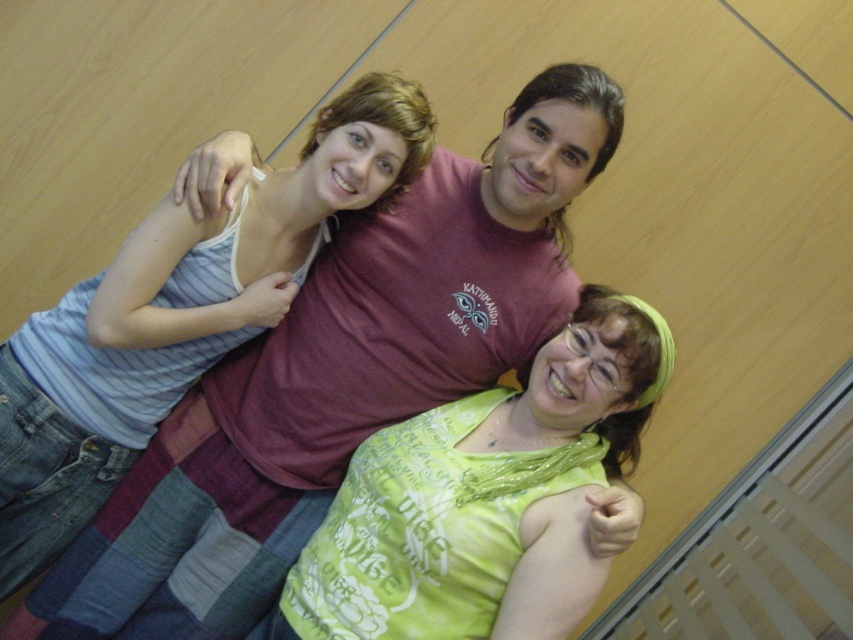
Who is more forward, (358, 589) or (218, 326)?

Point (358, 589)

Measure the distance between green fabric shirt at center and striped cotton tank top at upper left.

green fabric shirt at center and striped cotton tank top at upper left are 47.30 centimeters apart.

Who is more forward, (412, 464) or (204, 304)?

Point (412, 464) is more forward.

Locate an element on the screen. green fabric shirt at center is located at coordinates (483, 499).